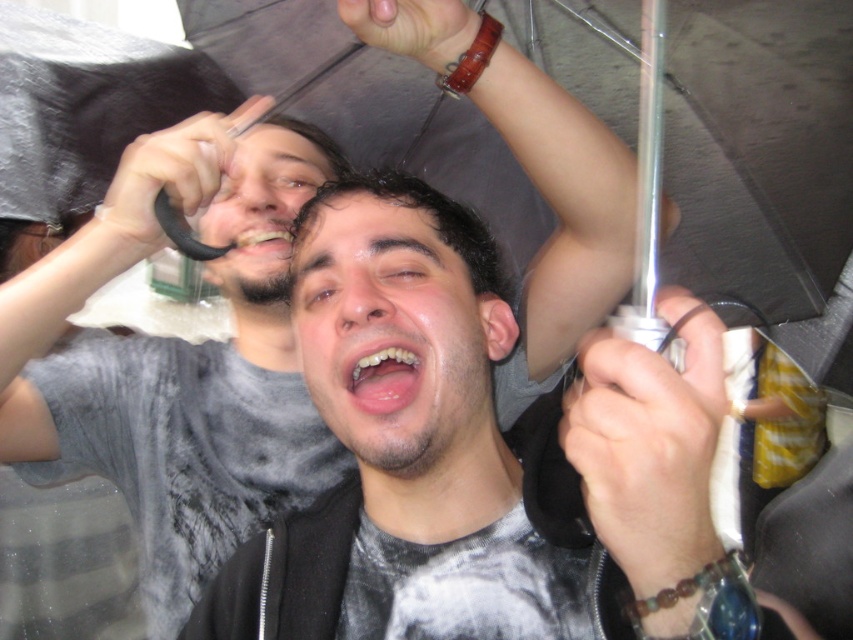
Who is positioned more to the left, transparent plastic umbrella at center or matte gray shirt at left?

From the viewer's perspective, matte gray shirt at left appears more on the left side.

Does transparent plastic umbrella at center appear on the left side of matte gray shirt at left?

Incorrect, transparent plastic umbrella at center is not on the left side of matte gray shirt at left.

The height and width of the screenshot is (640, 853). Identify the location of transparent plastic umbrella at center. 759,148.

Locate an element on the screen. The width and height of the screenshot is (853, 640). transparent plastic umbrella at center is located at coordinates (759, 148).